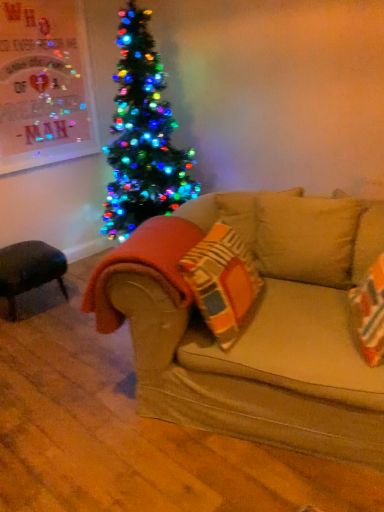
Question: From the image's perspective, is beige fabric couch at center on black leather ottoman at lower left?

Choices:
 (A) no
 (B) yes

Answer: (A)

Question: Is beige fabric couch at center thinner than black leather ottoman at lower left?

Choices:
 (A) yes
 (B) no

Answer: (B)

Question: From the image's perspective, is beige fabric couch at center located beneath black leather ottoman at lower left?

Choices:
 (A) yes
 (B) no

Answer: (A)

Question: Does beige fabric couch at center have a greater width compared to black leather ottoman at lower left?

Choices:
 (A) no
 (B) yes

Answer: (B)

Question: Is beige fabric couch at center at the right side of black leather ottoman at lower left?

Choices:
 (A) yes
 (B) no

Answer: (A)

Question: Is beige fabric couch at center outside of black leather ottoman at lower left?

Choices:
 (A) yes
 (B) no

Answer: (A)

Question: Considering the relative sizes of orange fuzzy blanket at lower left and black leather ottoman at lower left in the image provided, is orange fuzzy blanket at lower left taller than black leather ottoman at lower left?

Choices:
 (A) no
 (B) yes

Answer: (B)

Question: Are orange fuzzy blanket at lower left and black leather ottoman at lower left beside each other?

Choices:
 (A) yes
 (B) no

Answer: (B)

Question: Is black leather ottoman at lower left surrounded by orange fuzzy blanket at lower left?

Choices:
 (A) yes
 (B) no

Answer: (B)

Question: Is orange fuzzy blanket at lower left not near black leather ottoman at lower left?

Choices:
 (A) yes
 (B) no

Answer: (A)

Question: Does orange fuzzy blanket at lower left turn towards black leather ottoman at lower left?

Choices:
 (A) yes
 (B) no

Answer: (B)

Question: Does orange fuzzy blanket at lower left lie in front of black leather ottoman at lower left?

Choices:
 (A) no
 (B) yes

Answer: (B)

Question: Does black leather ottoman at lower left have a lesser width compared to orange fuzzy blanket at lower left?

Choices:
 (A) yes
 (B) no

Answer: (B)